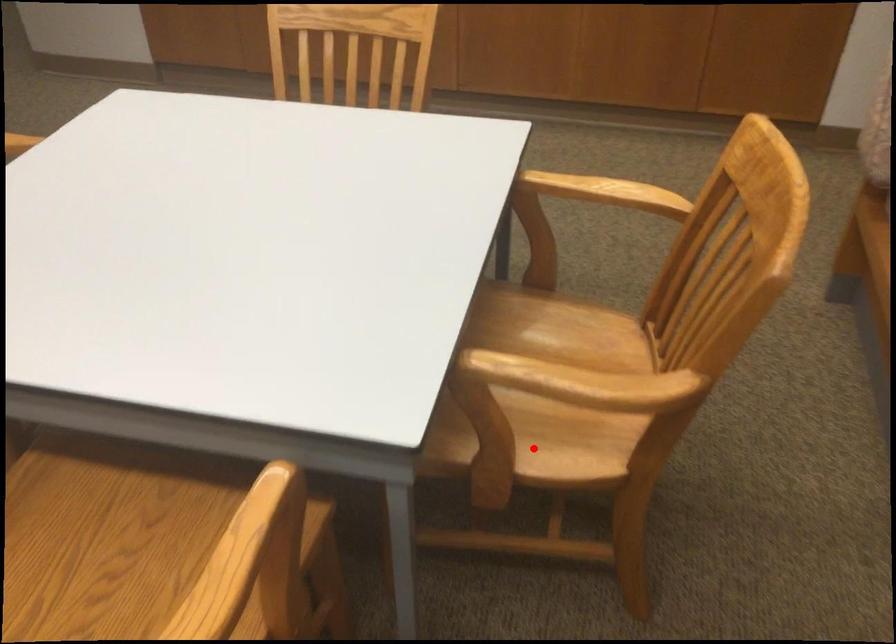
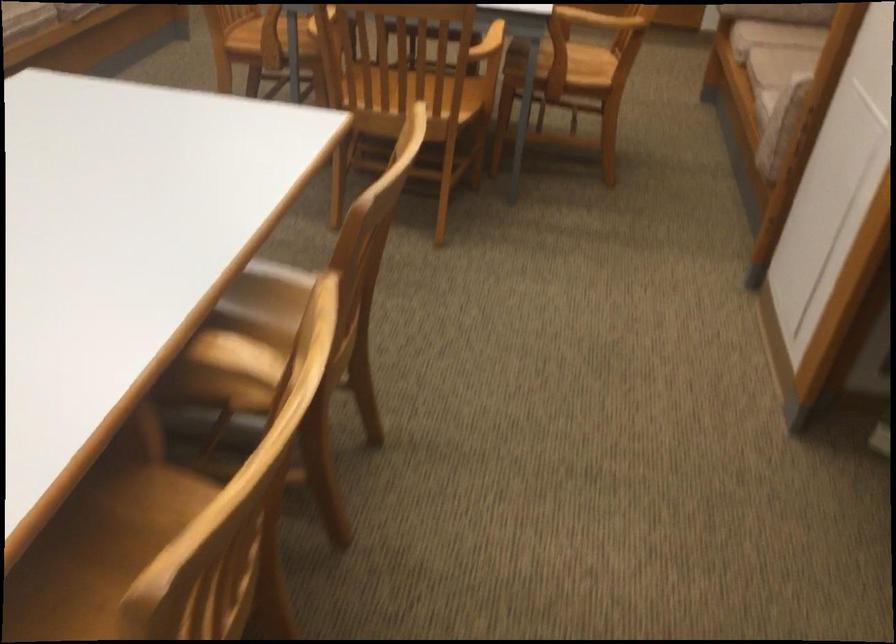
Question: I am providing you with two images of the same scene from different viewpoints. A red point is marked on the first image. Is the red point's position out of view in image 2?

Choices:
 (A) Yes
 (B) No

Answer: (B)